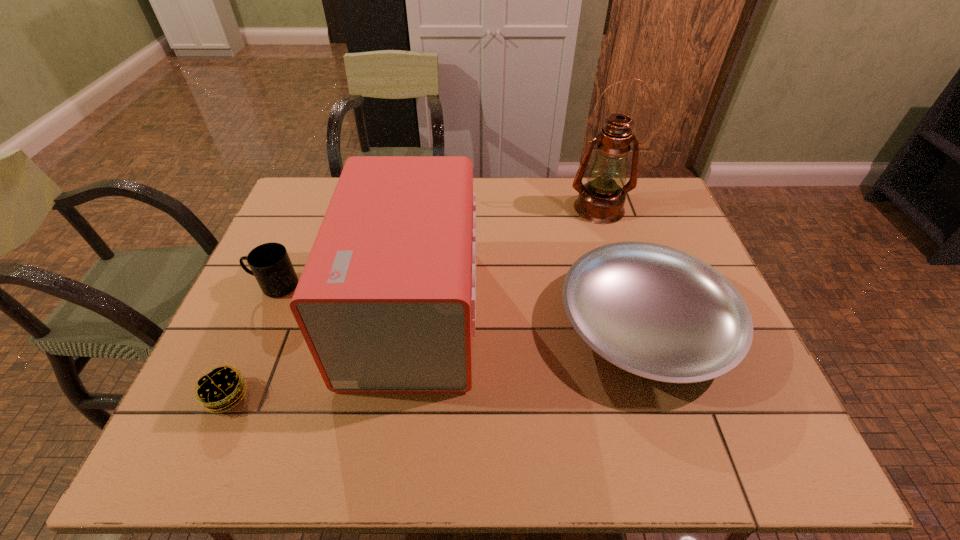
Locate an element on the screen. vacant space at the right edge of the desktop is located at coordinates (660, 238).

Locate an element on the screen. vacant space at the near left corner of the desktop is located at coordinates click(228, 440).

Locate an element on the screen. Image resolution: width=960 pixels, height=540 pixels. free location at the far right corner is located at coordinates (642, 215).

Where is `free area in between the box and the oil lamp`? The width and height of the screenshot is (960, 540). free area in between the box and the oil lamp is located at coordinates (506, 260).

At what (x,y) coordinates should I click in order to perform the action: click on object that stands as the second closest to the third shortest object. Please return your answer as a coordinate pair (x, y). The height and width of the screenshot is (540, 960). Looking at the image, I should click on (215, 389).

You are a GUI agent. You are given a task and a screenshot of the screen. Output one action in this format:
    pyautogui.click(x=<x>, y=<y>)
    Task: Click on the object that is the third closest to the third tallest object
    The width and height of the screenshot is (960, 540).
    Given the screenshot: What is the action you would take?
    pyautogui.click(x=655, y=311)

Where is `free space that satisfies the following two spatial constraints: 1. on the side of the third tallest object with the handle; 2. on the left side of the bedpan`? This screenshot has height=540, width=960. free space that satisfies the following two spatial constraints: 1. on the side of the third tallest object with the handle; 2. on the left side of the bedpan is located at coordinates (258, 325).

Find the location of a particular element. Image resolution: width=960 pixels, height=540 pixels. free spot that satisfies the following two spatial constraints: 1. on the side of the third shortest object with the handle; 2. on the front side of the patty is located at coordinates (228, 395).

The width and height of the screenshot is (960, 540). Identify the location of free spot that satisfies the following two spatial constraints: 1. on the back side of the bedpan; 2. on the side of the mug with the handle. (632, 286).